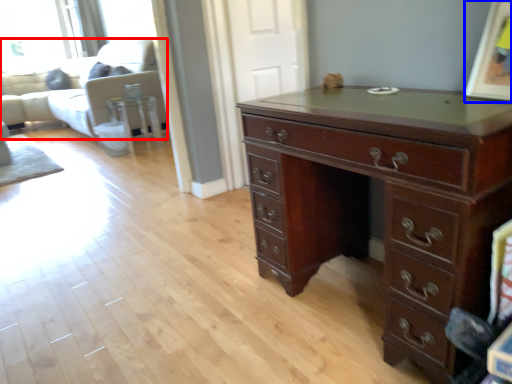
Question: Which object appears farthest to the camera in this image, couch (highlighted by a red box) or picture frame (highlighted by a blue box)?

Choices:
 (A) couch
 (B) picture frame

Answer: (A)